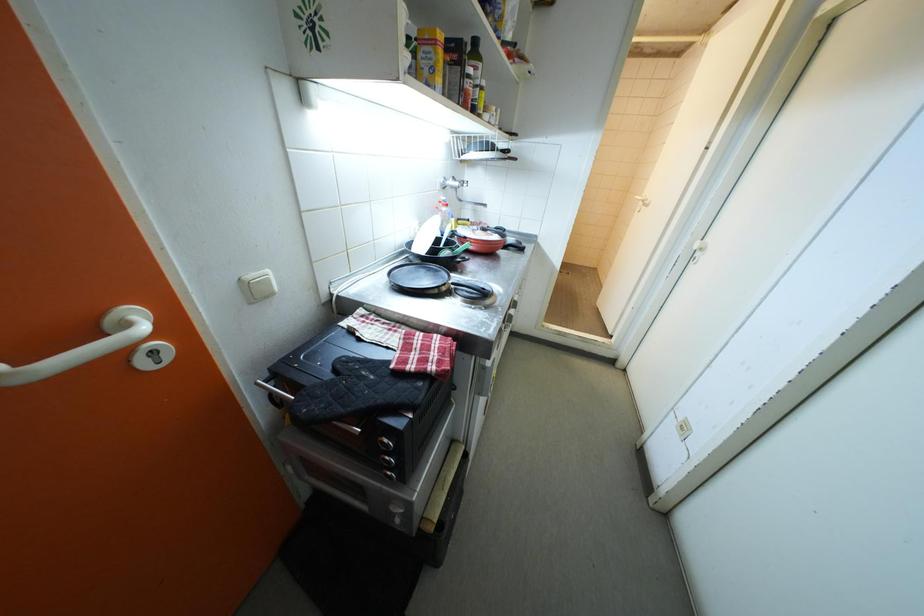
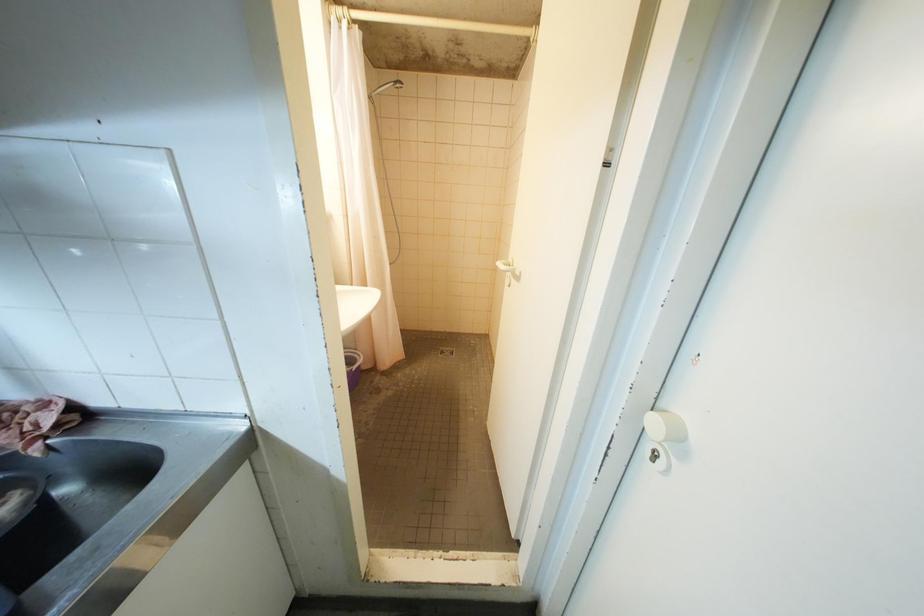
What movement of the cameraman would produce the second image?

The cameraman walked toward right, forward.